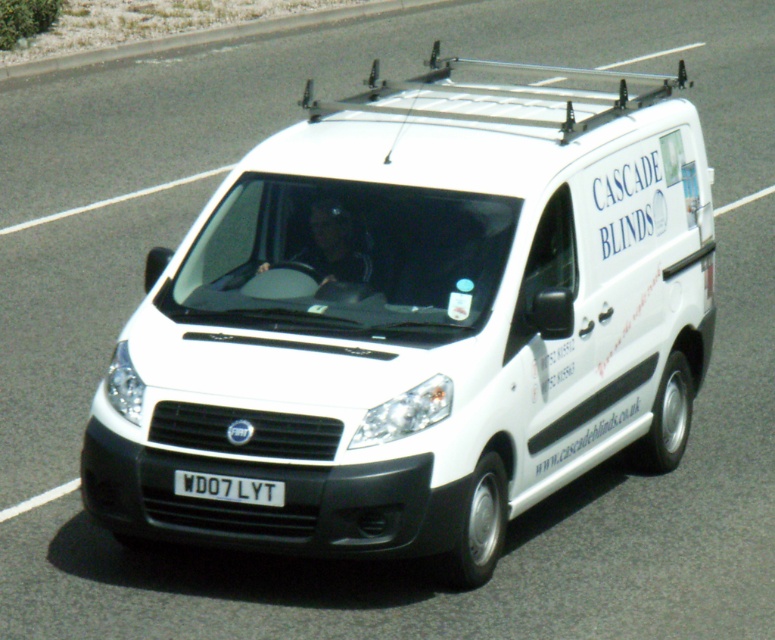
You are a delivery driver who needs to enter a low clearance tunnel. The tunnel has a height restriction of 2 meters. You are driving the white matte van at center which has a white plastic license plate at center. Can you safely pass through the tunnel without hitting the roof?

The white matte van at center is much taller than the white plastic license plate at center, but the exact height of the van is not provided. Therefore, it is uncertain whether it can safely pass through the 2 meter clearance tunnel.

You are a traffic officer observing a white matte van at center and a white plastic license plate at center. Which object is located to the right of the other?

The white matte van at center is positioned on the right side of white plastic license plate at center.